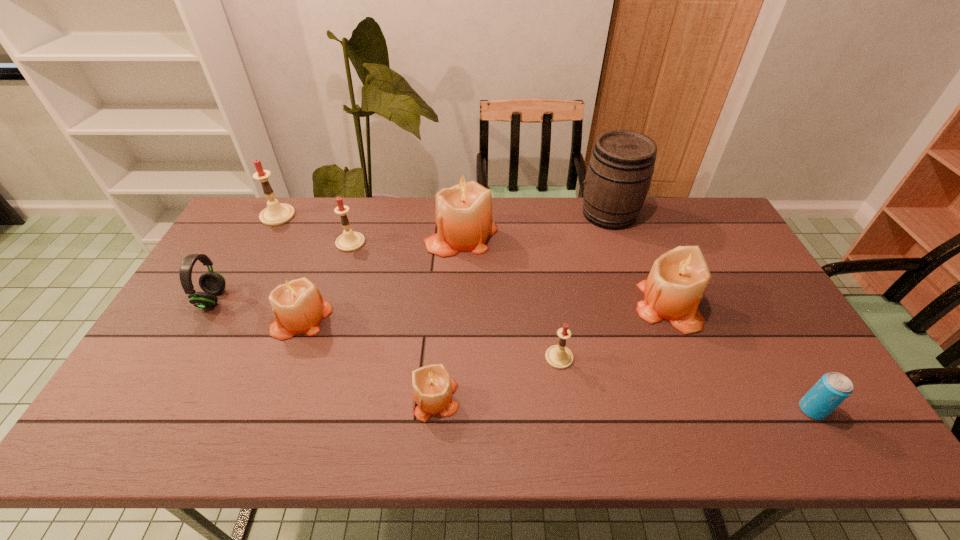
You are a GUI agent. You are given a task and a screenshot of the screen. Output one action in this format:
    pyautogui.click(x=<x>, y=<y>)
    Task: Click on the unoccupied area between the second smallest beige candle and the smallest beige candle
    This screenshot has width=960, height=540.
    Given the screenshot: What is the action you would take?
    pyautogui.click(x=369, y=359)

At what (x,y) coordinates should I click in order to perform the action: click on free space that is in between the farthest red candle and the headset. Please return your answer as a coordinate pair (x, y). Looking at the image, I should click on (245, 258).

Identify the location of free space between the nearest candle and the soda can. Image resolution: width=960 pixels, height=540 pixels. (624, 404).

Identify the location of vacant region between the rightmost object and the farthest beige candle. point(636,322).

Identify the location of free space between the wine bucket and the nearest red candle. The image size is (960, 540). (584, 286).

Where is `vacant area that lies between the rightmost beige candle and the wine bucket`? The width and height of the screenshot is (960, 540). vacant area that lies between the rightmost beige candle and the wine bucket is located at coordinates (637, 260).

At what (x,y) coordinates should I click in order to perform the action: click on empty location between the headset and the rightmost candle. Please return your answer as a coordinate pair (x, y). The width and height of the screenshot is (960, 540). Looking at the image, I should click on (440, 302).

Locate an element on the screen. This screenshot has height=540, width=960. free spot between the wine bucket and the headset is located at coordinates (411, 256).

The image size is (960, 540). I want to click on object that ranks as the second closest to the wine bucket, so click(464, 220).

At what (x,y) coordinates should I click in order to perform the action: click on object that stands as the eighth closest to the biggest beige candle. Please return your answer as a coordinate pair (x, y). Looking at the image, I should click on (212, 283).